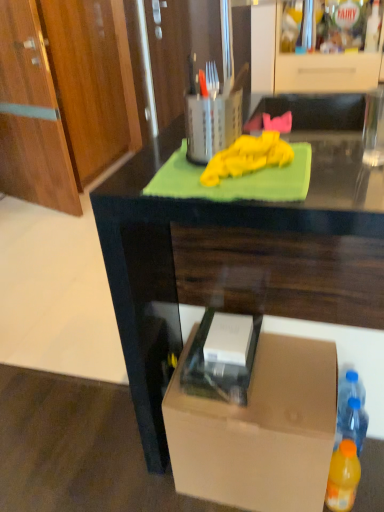
Question: From a real-world perspective, is dark wood desk at center physically below orange plastic bottle at lower right, placed as the second bottle when sorted from back to front?

Choices:
 (A) no
 (B) yes

Answer: (A)

Question: Is dark wood desk at center at the left side of orange plastic bottle at lower right, placed as the second bottle when sorted from back to front?

Choices:
 (A) no
 (B) yes

Answer: (B)

Question: Does dark wood desk at center have a greater width compared to orange plastic bottle at lower right, placed as the second bottle when sorted from back to front?

Choices:
 (A) yes
 (B) no

Answer: (A)

Question: Is there a large distance between dark wood desk at center and orange plastic bottle at lower right, placed as the second bottle when sorted from back to front?

Choices:
 (A) yes
 (B) no

Answer: (B)

Question: Is dark wood desk at center taller than orange plastic bottle at lower right, positioned as the 1th bottle in front-to-back order?

Choices:
 (A) no
 (B) yes

Answer: (B)

Question: Is point (291, 61) closer or farther from the camera than point (243, 503)?

Choices:
 (A) farther
 (B) closer

Answer: (A)

Question: Considering the positions of matte wood cabinet at upper center and brown cardboard box at lower right in the image, is matte wood cabinet at upper center taller or shorter than brown cardboard box at lower right?

Choices:
 (A) tall
 (B) short

Answer: (A)

Question: In terms of size, does matte wood cabinet at upper center appear bigger or smaller than brown cardboard box at lower right?

Choices:
 (A) big
 (B) small

Answer: (A)

Question: From a real-world perspective, relative to brown cardboard box at lower right, is matte wood cabinet at upper center vertically above or below?

Choices:
 (A) below
 (B) above

Answer: (B)

Question: Considering the positions of dark wood desk at center and blue plastic bottle at lower right, which ranks as the first bottle in back-to-front order, in the image, is dark wood desk at center wider or thinner than blue plastic bottle at lower right, which ranks as the first bottle in back-to-front order,?

Choices:
 (A) wide
 (B) thin

Answer: (A)

Question: From the image's perspective, relative to blue plastic bottle at lower right, which ranks as the first bottle in back-to-front order, is dark wood desk at center above or below?

Choices:
 (A) below
 (B) above

Answer: (B)

Question: Visually, is dark wood desk at center positioned to the left or to the right of blue plastic bottle at lower right, acting as the 2th bottle starting from the front?

Choices:
 (A) right
 (B) left

Answer: (B)

Question: Is dark wood desk at center bigger or smaller than blue plastic bottle at lower right, which ranks as the first bottle in back-to-front order?

Choices:
 (A) big
 (B) small

Answer: (A)

Question: In terms of size, does orange plastic bottle at lower right, placed as the second bottle when sorted from back to front, appear bigger or smaller than matte wood cabinet at upper center?

Choices:
 (A) big
 (B) small

Answer: (B)

Question: In terms of height, does orange plastic bottle at lower right, placed as the second bottle when sorted from back to front, look taller or shorter compared to matte wood cabinet at upper center?

Choices:
 (A) tall
 (B) short

Answer: (B)